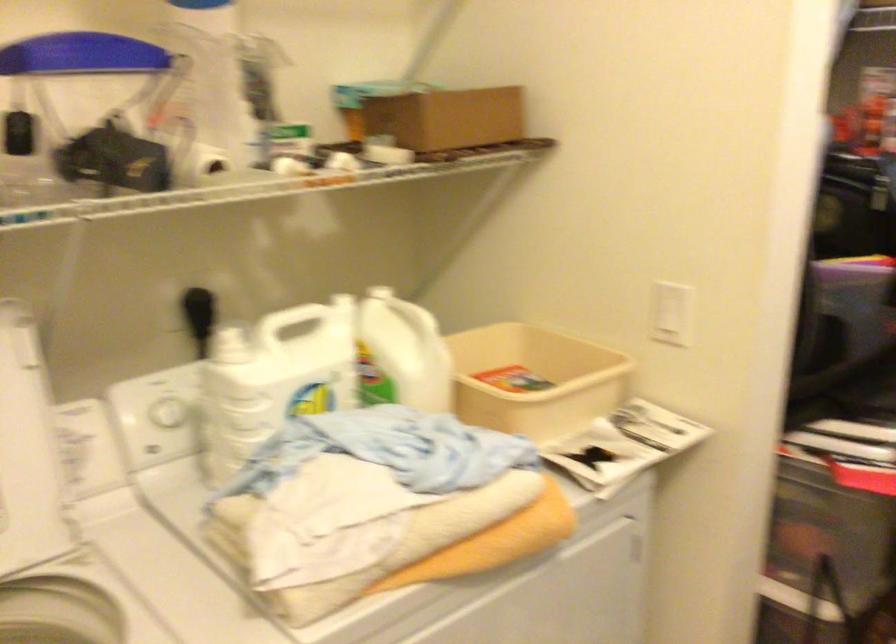
Question: Based on the continuous images, in which direction is the camera rotating? Reply with the corresponding letter.

Choices:
 (A) Left
 (B) Right
 (C) Up
 (D) Down

Answer: (B)